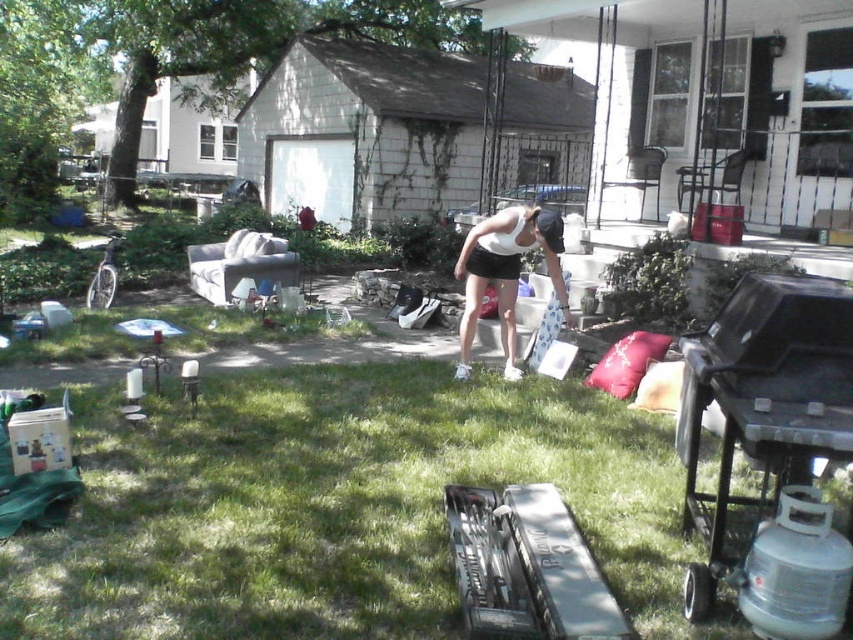
Which is more to the right, black matte barbecue grill at lower right or white matte tank top at center?

black matte barbecue grill at lower right is more to the right.

Is black matte barbecue grill at lower right smaller than white matte tank top at center?

Correct, black matte barbecue grill at lower right occupies less space than white matte tank top at center.

The width and height of the screenshot is (853, 640). In order to click on black matte barbecue grill at lower right in this screenshot , I will do `click(762, 404)`.